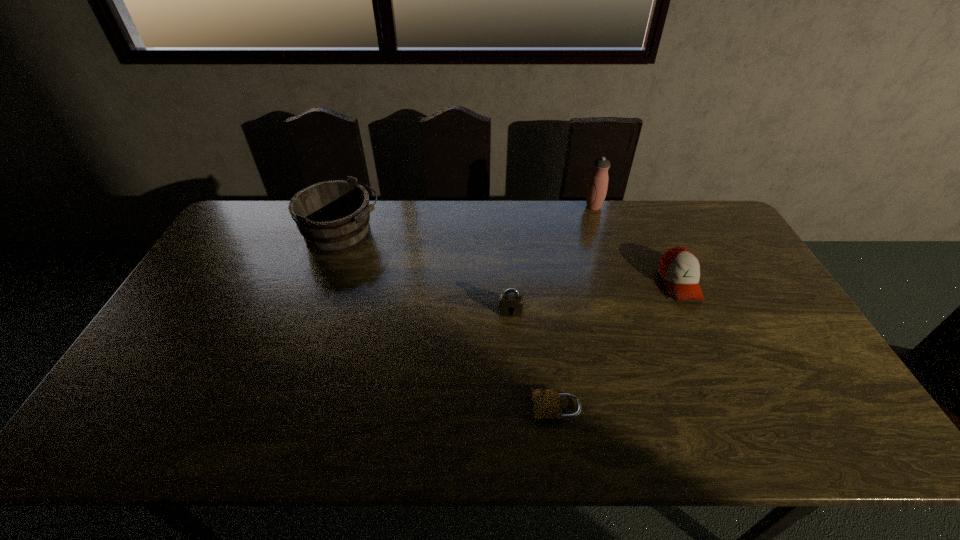
You are a GUI agent. You are given a task and a screenshot of the screen. Output one action in this format:
    pyautogui.click(x=<x>, y=<y>)
    Task: Click on the thermos bottle
    
    Given the screenshot: What is the action you would take?
    pyautogui.click(x=597, y=187)

Image resolution: width=960 pixels, height=540 pixels. In order to click on the farthest object in this screenshot , I will do `click(597, 187)`.

Image resolution: width=960 pixels, height=540 pixels. In order to click on the fourth shortest object in this screenshot , I will do `click(333, 216)`.

Where is `the leftmost object`? The image size is (960, 540). the leftmost object is located at coordinates (333, 216).

Locate an element on the screen. baseball cap is located at coordinates (679, 268).

This screenshot has width=960, height=540. Find the location of `the farther padlock`. the farther padlock is located at coordinates (511, 302).

Locate an element on the screen. the taller padlock is located at coordinates (511, 302).

Find the location of a particular element. This screenshot has height=540, width=960. the shorter padlock is located at coordinates (546, 402).

Where is `the right padlock`? This screenshot has height=540, width=960. the right padlock is located at coordinates (546, 402).

Locate an element on the screen. This screenshot has height=540, width=960. blank area located 0.370m on the left of the thermos bottle is located at coordinates (485, 207).